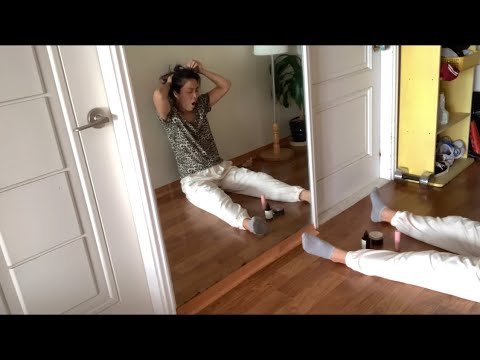
Where is `bottle`? This screenshot has height=360, width=480. bottle is located at coordinates [x=398, y=242].